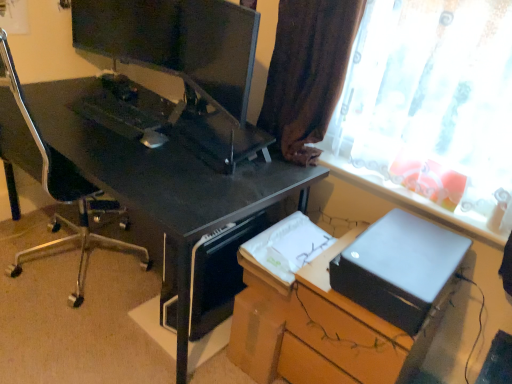
Describe the element at coordinates (308, 72) in the screenshot. I see `brown fabric curtain at upper right` at that location.

Where is `brown fabric curtain at upper right`? The width and height of the screenshot is (512, 384). brown fabric curtain at upper right is located at coordinates [308, 72].

Is satin black printer at lower right far away from black glossy desk at center?

No.

Who is bigger, satin black printer at lower right or black glossy desk at center?

With larger size is black glossy desk at center.

Is point (261, 301) in front of point (115, 187)?

No, (261, 301) is further to viewer.

In the scene shown: What's the angular difference between satin black printer at lower right and black glossy desk at center's facing directions?

satin black printer at lower right and black glossy desk at center are facing 1.4 degrees away from each other.

Is point (280, 72) closer or farther from the camera than point (400, 279)?

Point (280, 72) is positioned farther from the camera compared to point (400, 279).

Who is taller, brown fabric curtain at upper right or matte black printer at right?

brown fabric curtain at upper right.

Relative to matte black printer at right, is brown fabric curtain at upper right in front or behind?

brown fabric curtain at upper right is positioned farther from the viewer than matte black printer at right.

Consider the image. Is brown fabric curtain at upper right facing towards matte black printer at right?

No.

Where is `computer monitor lying above the brown fabric curtain at upper right (from the image's perspective)`? computer monitor lying above the brown fabric curtain at upper right (from the image's perspective) is located at coordinates (219, 52).

Who is smaller, matte black monitor at upper center or brown fabric curtain at upper right?

Smaller between the two is matte black monitor at upper center.

Is matte black monitor at upper center to the left or to the right of brown fabric curtain at upper right in the image?

From the image, it's evident that matte black monitor at upper center is to the left of brown fabric curtain at upper right.

Is there a large distance between translucent fabric curtain at upper right and matte black printer at right?

No.

Is translucent fabric curtain at upper right in front of or behind matte black printer at right in the image?

In the image, translucent fabric curtain at upper right appears in front of matte black printer at right.

Considering the points (366, 45) and (445, 251), which point is behind, point (366, 45) or point (445, 251)?

The point (366, 45) is behind.

Considering the relative sizes of translucent fabric curtain at upper right and matte black printer at right in the image provided, is translucent fabric curtain at upper right taller than matte black printer at right?

Yes, translucent fabric curtain at upper right is taller than matte black printer at right.

Considering the positions of point (428, 295) and point (290, 77), is point (428, 295) closer or farther from the camera than point (290, 77)?

Point (428, 295) is positioned closer to the camera compared to point (290, 77).

From the image's perspective, is matte black printer at right above or below brown fabric curtain at upper right?

From the image's perspective, matte black printer at right appears below brown fabric curtain at upper right.

Is matte black printer at right not close to brown fabric curtain at upper right?

That's not correct — matte black printer at right is a little close to brown fabric curtain at upper right.

Is black glossy desk at center placed right next to matte black printer at right?

black glossy desk at center and matte black printer at right are clearly separated.

Considering the positions of points (10, 102) and (401, 281), is point (10, 102) closer to camera compared to point (401, 281)?

No, it is not.

Is black glossy desk at center in front of matte black printer at right?

No, the depth of black glossy desk at center is greater than that of matte black printer at right.

From a real-world perspective, between black glossy desk at center and matte black printer at right, who is vertically higher?

matte black printer at right.

From a real-world perspective, who is located lower, satin black printer at lower right or translucent fabric curtain at upper right?

From a 3D spatial view, satin black printer at lower right is below.

Between satin black printer at lower right and translucent fabric curtain at upper right, which one is positioned in front?

translucent fabric curtain at upper right is in front.

Identify the location of dresser that is below the black glossy desk at center (from the image's perspective). The image size is (512, 384). tap(320, 330).

The image size is (512, 384). In the image, there is a brown fabric curtain at upper right. In order to click on cardboard box below it (from a real-world perspective) in this screenshot , I will do `click(398, 268)`.

Estimate the real-world distances between objects in this image. Which object is further from black plastic computer tower at lower center, satin black printer at lower right or translucent fabric curtain at upper right?

translucent fabric curtain at upper right is positioned further to the anchor black plastic computer tower at lower center.

When comparing their distances from satin black printer at lower right, does matte black monitor at upper center or black glossy desk at center seem further?

matte black monitor at upper center is positioned further to the anchor satin black printer at lower right.

When comparing their distances from black plastic computer tower at lower center, does satin black printer at lower right or matte black printer at right seem further?

matte black printer at right is further to black plastic computer tower at lower center.

When comparing their distances from brown fabric curtain at upper right, does satin black printer at lower right or black plastic computer tower at lower center seem further?

satin black printer at lower right is further to brown fabric curtain at upper right.

Looking at the image, which one is located closer to matte black monitor at upper center, black glossy desk at center or brown fabric curtain at upper right?

brown fabric curtain at upper right is closer to matte black monitor at upper center.

From the image, which object appears to be farther from black plastic computer tower at lower center, matte black printer at right or translucent fabric curtain at upper right?

translucent fabric curtain at upper right lies further to black plastic computer tower at lower center than the other object.

Which object lies further to the anchor point translucent fabric curtain at upper right, black plastic computer tower at lower center or black glossy desk at center?

Among the two, black plastic computer tower at lower center is located further to translucent fabric curtain at upper right.

Considering their positions, is matte black monitor at upper center positioned closer to satin black printer at lower right than translucent fabric curtain at upper right?

translucent fabric curtain at upper right is positioned closer to the anchor satin black printer at lower right.

Where is `curtain between black glossy desk at center and matte black printer at right in the horizontal direction`? curtain between black glossy desk at center and matte black printer at right in the horizontal direction is located at coordinates coord(308,72).

Locate an element on the screen. curtain between black plastic computer tower at lower center and translucent fabric curtain at upper right is located at coordinates (x=308, y=72).

Find the location of a particular element. The image size is (512, 384). dresser between black plastic computer tower at lower center and matte black printer at right from left to right is located at coordinates (320, 330).

Find the location of `curtain situated between matte black monitor at upper center and translucent fabric curtain at upper right from left to right`. curtain situated between matte black monitor at upper center and translucent fabric curtain at upper right from left to right is located at coordinates pyautogui.click(x=308, y=72).